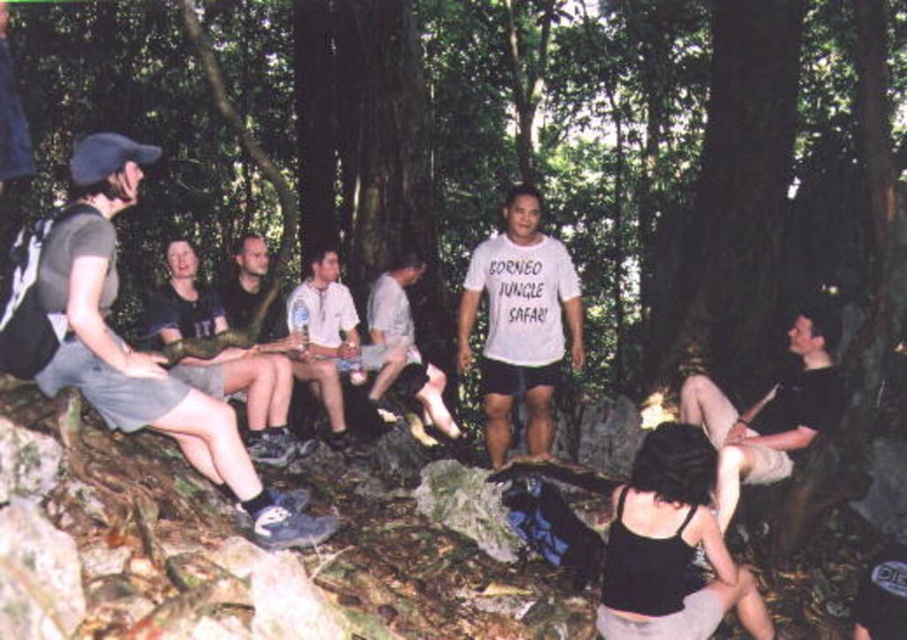
You are a photographer trying to capture the entire group in the Borneo jungle. You notice the black cotton shirt at lower right is positioned at a specific location. To include everyone in the frame, should you adjust your camera angle upwards or downwards?

The black cotton shirt at lower right is positioned at point (767, 413), which is relatively low on the image plane. To include everyone in the frame, you should adjust your camera angle slightly upwards to ensure the lower positioned individuals are captured without cropping them out.

You are a photographer planning to capture a group photo of the participants in the Borneo Jungle Safari. You notice two shirts in the scene, the black cotton shirt at lower right and the white cotton shirt at center. Which shirt should you focus on if you want to ensure the subject fills the frame better due to its size?

The black cotton shirt at lower right should be focused on because its width is larger than the white cotton shirt at center, making it better suited for filling the frame.